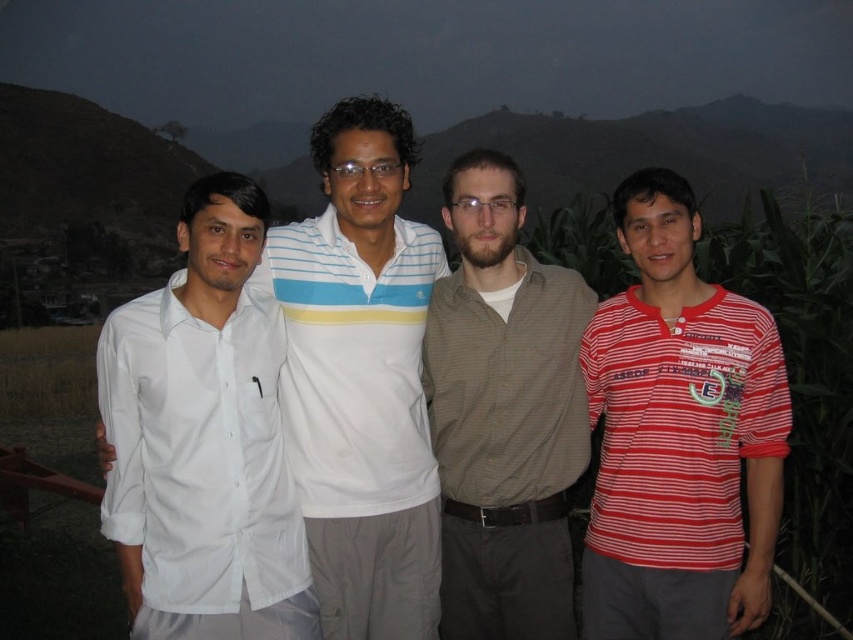
You are standing in front of the image and want to reach the white cotton shirt at center. The path is clear, but you can only move forward 20 feet. Can you reach it?

The white cotton shirt at center is 22.35 feet from viewer, so you cannot reach it within 20 feet.

You are a photographer trying to capture a group photo of the brown textured shirt at center and the white striped polo shirt at center. Based on their positions, which one should you focus on first to ensure both are in frame?

The brown textured shirt at center is located below the white striped polo shirt at center, so you should focus on the white striped polo shirt at center first to ensure both are in the frame.

In the scene, there is a point at coordinates [363,378]. Which object from the list is located at this position?

The point at coordinates [363,378] corresponds to the white cotton shirt at center.